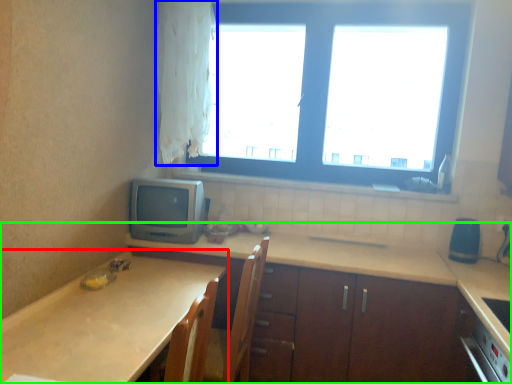
Question: Which object is positioned closest to countertop (highlighted by a red box)? Select from curtain (highlighted by a blue box) and countertop (highlighted by a green box).

Choices:
 (A) curtain
 (B) countertop

Answer: (B)